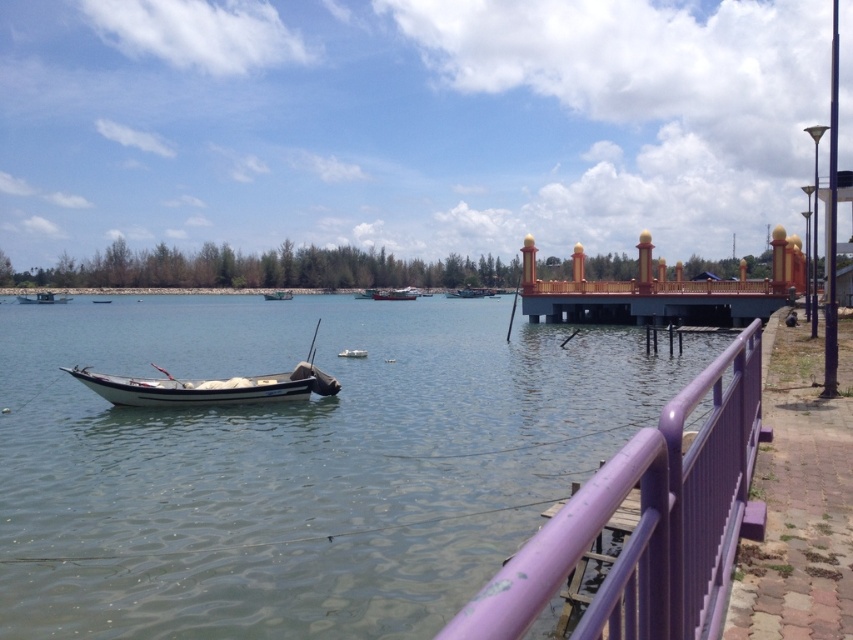
Question: Which of these objects is positioned closest to the purple painted metal railing at lower right?

Choices:
 (A) clear water at center
 (B) white matte boat at lower left
 (C) white matte boat at left
 (D) white plastic boat at lower left

Answer: (B)

Question: Is clear water at center bigger than white matte boat at lower left?

Choices:
 (A) no
 (B) yes

Answer: (B)

Question: Which point appears closest to the camera in this image?

Choices:
 (A) pos(152,397)
 (B) pos(380,298)

Answer: (A)

Question: Does metallic gray boat at center appear on the right side of white matte boat at left?

Choices:
 (A) yes
 (B) no

Answer: (A)

Question: Observing the image, what is the correct spatial positioning of white plastic boat at lower left in reference to metallic gray boat at center?

Choices:
 (A) above
 (B) below

Answer: (B)

Question: Which point is closer to the camera?

Choices:
 (A) (99, 301)
 (B) (450, 292)
 (C) (35, 296)
 (D) (283, 292)

Answer: (A)